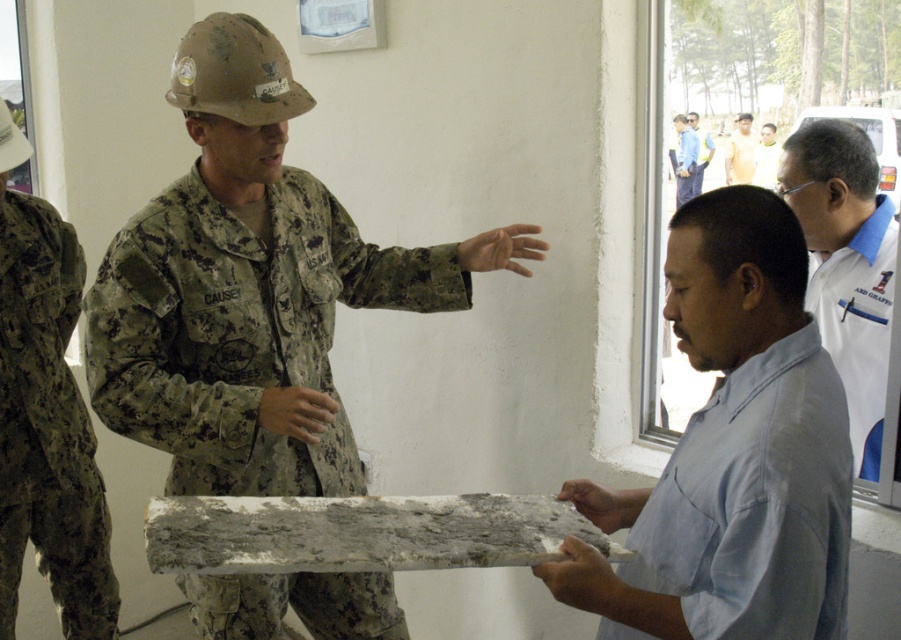
Identify the location of white shirt at right. (845, 266).

Image resolution: width=901 pixels, height=640 pixels. In order to click on white shirt at right in this screenshot , I will do [845, 266].

From the picture: Between matte gray concrete slab at center and light brown skin at center, which one appears on the left side from the viewer's perspective?

From the viewer's perspective, matte gray concrete slab at center appears more on the left side.

Is point (760, 440) in front of point (731, 145)?

Yes.

The height and width of the screenshot is (640, 901). In order to click on matte gray concrete slab at center in this screenshot , I will do `click(731, 452)`.

Between white shirt at right and white matte shirt at upper right, which one appears on the left side from the viewer's perspective?

white shirt at right

Does white shirt at right appear under white matte shirt at upper right?

Yes, white shirt at right is below white matte shirt at upper right.

Who is more distant from viewer, [890,285] or [776,156]?

The point [776,156] is more distant.

Where is `white shirt at right`? white shirt at right is located at coordinates (845, 266).